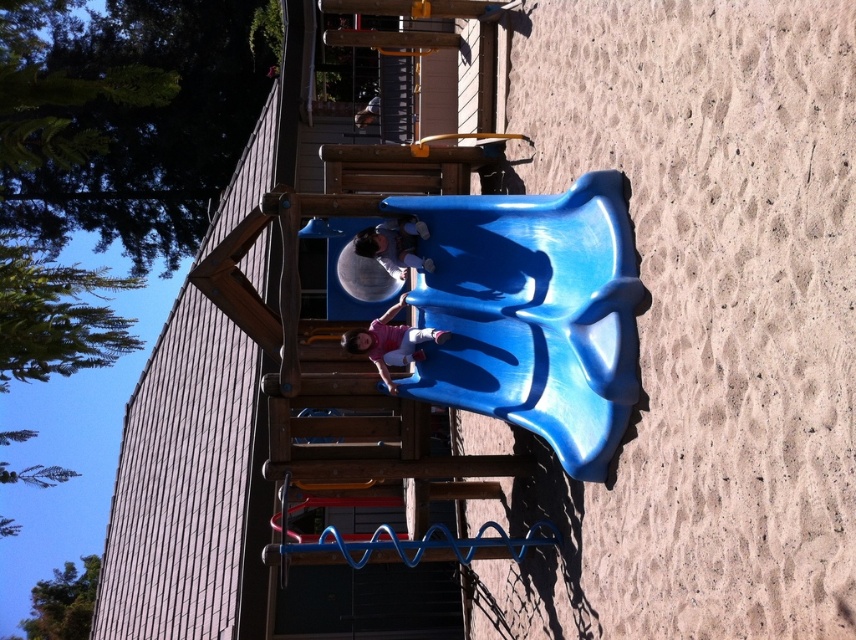
You are standing at the playground and want to know how far the point at coordinates point (358, 332) is from you. Can you determine the distance?

The distance of point (358, 332) from camera is 29.92 feet.

You are a parent supervising children at the playground. You see the matte pink shirt at center and the matte blue slide at center. Which object is taller from your viewpoint?

The matte pink shirt at center is taller than the matte blue slide at center.

You are a parent trying to ensure your child stays safe on the playground. You see the blue plastic slide at center and the matte pink shirt at center. Which object is bigger and could potentially block the slide if placed in front of it?

The blue plastic slide at center is larger than the matte pink shirt at center, so it could potentially block the slide if placed in front of it.